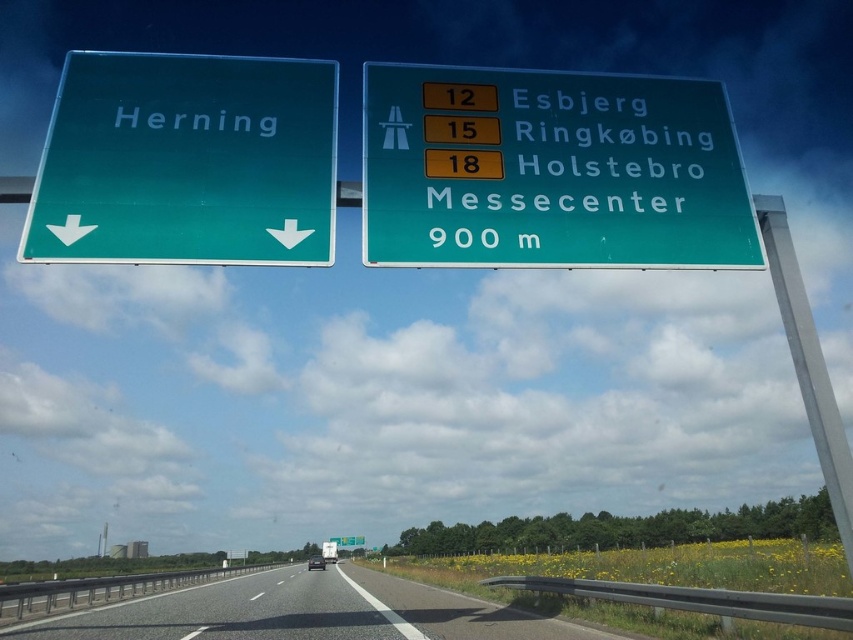
Question: Which object is positioned closest to the green glossy signboard at upper center?

Choices:
 (A) green glossy sign at left
 (B) asphalt road at center

Answer: (A)

Question: Can you confirm if green glossy signboard at upper center is smaller than asphalt road at center?

Choices:
 (A) no
 (B) yes

Answer: (B)

Question: Considering the relative positions of green glossy sign at left and asphalt road at center in the image provided, where is green glossy sign at left located with respect to asphalt road at center?

Choices:
 (A) above
 (B) below

Answer: (A)

Question: Is green glossy sign at left smaller than asphalt road at center?

Choices:
 (A) no
 (B) yes

Answer: (B)

Question: Which point is farther from the camera taking this photo?

Choices:
 (A) (457, 628)
 (B) (181, 109)
 (C) (480, 160)

Answer: (A)

Question: Which point appears closest to the camera in this image?

Choices:
 (A) (292, 115)
 (B) (491, 115)
 (C) (259, 636)

Answer: (A)